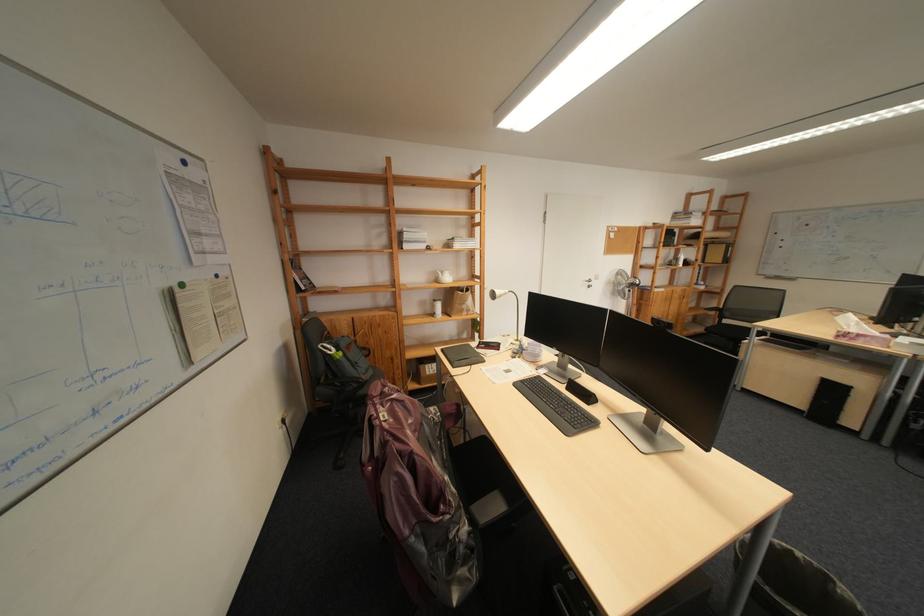
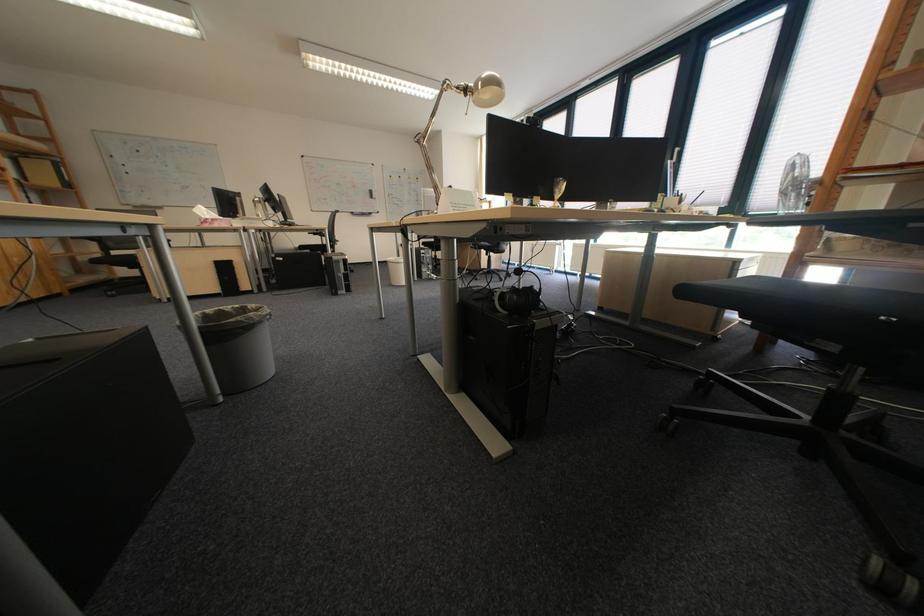
Locate, in the second image, the point that corresponds to [868,339] in the first image.

(225, 225)